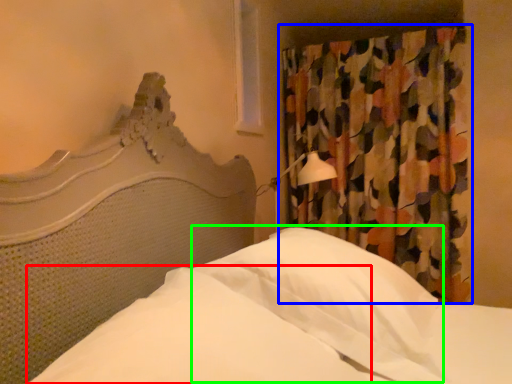
Question: Based on their relative distances, which object is farther from sheet (highlighted by a red box)? Choose from curtain (highlighted by a blue box) and pillow (highlighted by a green box).

Choices:
 (A) curtain
 (B) pillow

Answer: (A)